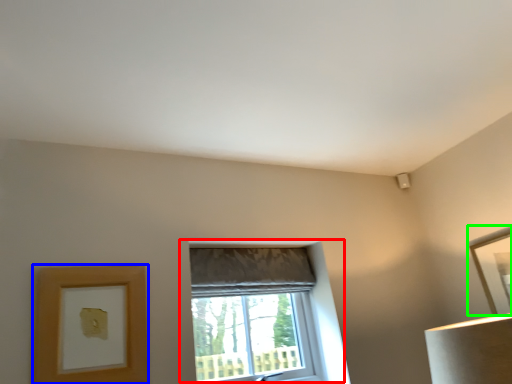
Question: Which is farther away from window (highlighted by a red box)? picture frame (highlighted by a blue box) or picture frame (highlighted by a green box)?

Choices:
 (A) picture frame
 (B) picture frame

Answer: (B)